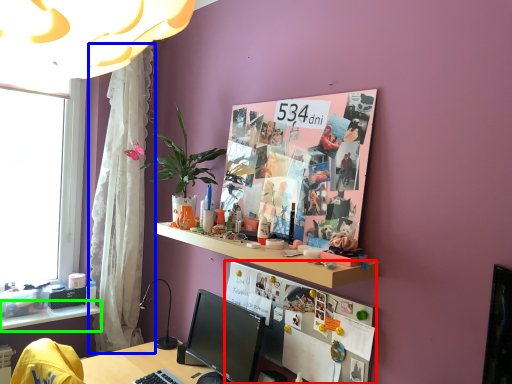
Question: Considering the real-world distances, which object is closest to bulletin board (highlighted by a red box)? curtain (highlighted by a blue box) or shelf (highlighted by a green box).

Choices:
 (A) curtain
 (B) shelf

Answer: (A)